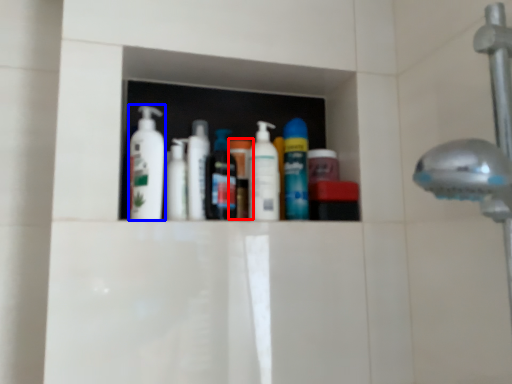
Question: Which of the following is the closest to the observer, toiletry (highlighted by a red box) or cleaning product (highlighted by a blue box)?

Choices:
 (A) toiletry
 (B) cleaning product

Answer: (B)